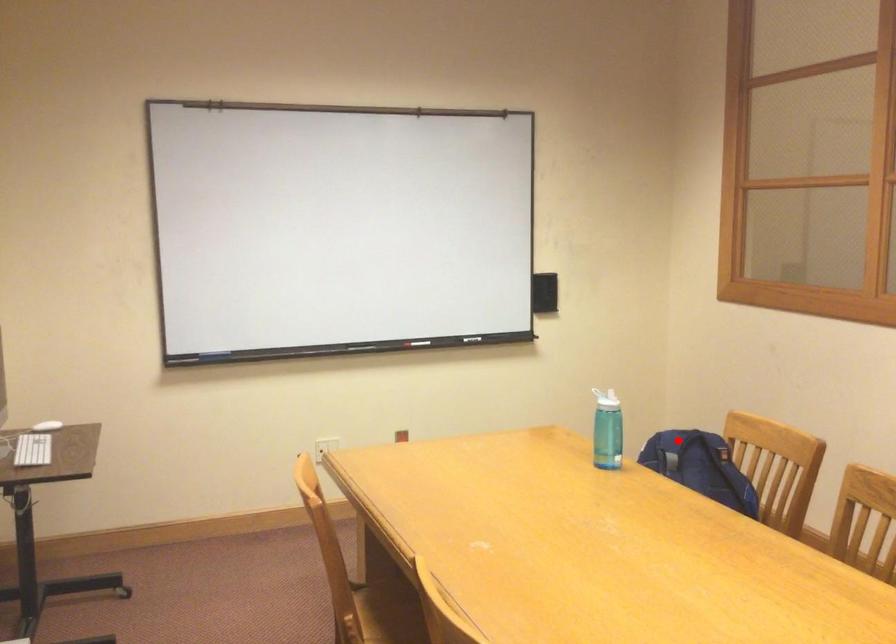
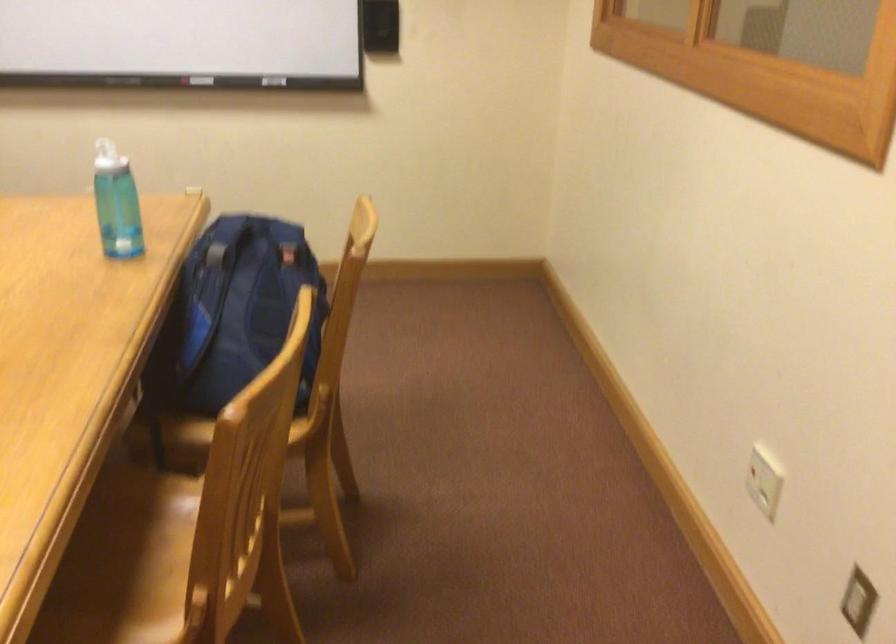
Find the pixel in the second image that matches the highlighted location in the first image.

(254, 225)